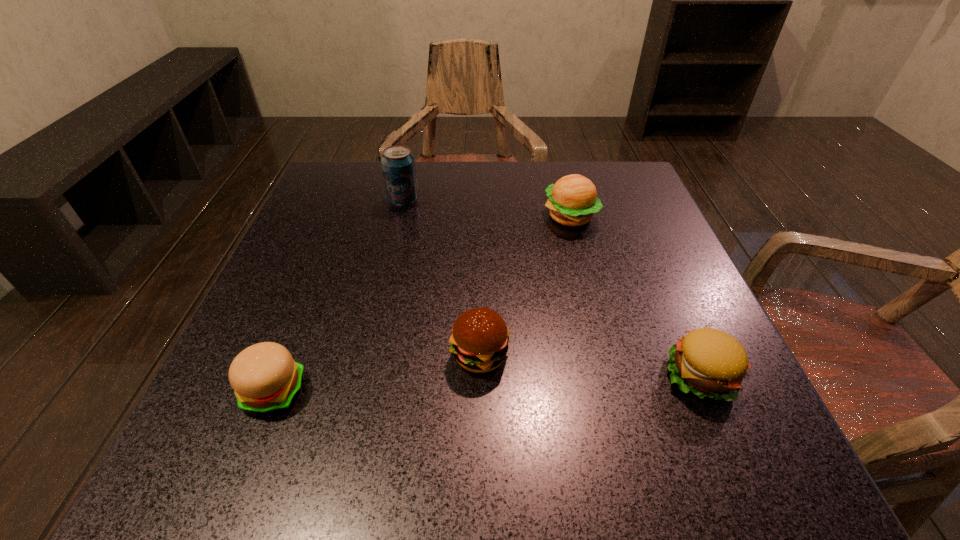
I want to click on pop soda, so click(x=398, y=164).

Locate an element on the screen. the tallest object is located at coordinates (398, 164).

I want to click on the farthest hamburger, so click(573, 200).

Image resolution: width=960 pixels, height=540 pixels. Find the location of `the second hamburger from right to left`. the second hamburger from right to left is located at coordinates (573, 200).

I want to click on the third hamburger from right to left, so click(479, 342).

At what (x,y) coordinates should I click in order to perform the action: click on the leftmost hamburger. Please return your answer as a coordinate pair (x, y). Looking at the image, I should click on (265, 378).

The image size is (960, 540). I want to click on the rightmost hamburger, so click(711, 363).

Identify the location of vacant space situated on the right of the fourth object from right to left. (449, 201).

Identify the location of vacant point located 0.150m on the back of the fourth object from left to right. The image size is (960, 540). (558, 167).

Locate an element on the screen. free spot located 0.350m on the left of the third object from right to left is located at coordinates (230, 355).